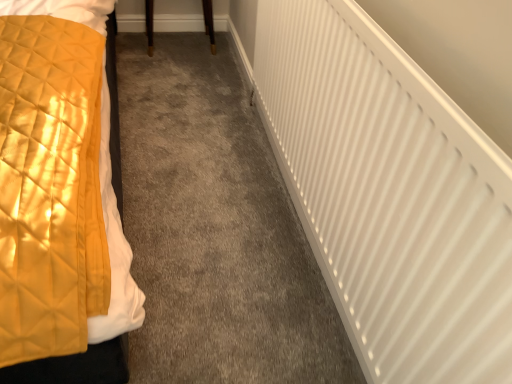
The height and width of the screenshot is (384, 512). Describe the element at coordinates (390, 194) in the screenshot. I see `white matte radiator at right` at that location.

At what (x,y) coordinates should I click in order to perform the action: click on white matte radiator at right. Please return your answer as a coordinate pair (x, y). The image size is (512, 384). Looking at the image, I should click on (390, 194).

Locate an element on the screen. brown wood table at upper center is located at coordinates (209, 23).

Describe the element at coordinates (209, 23) in the screenshot. I see `brown wood table at upper center` at that location.

Measure the distance between brown wood table at upper center and camera.

2.44 meters.

What is the approximate width of brown wood table at upper center?

brown wood table at upper center is 34.01 centimeters wide.

At what (x,y) coordinates should I click in order to perform the action: click on white matte radiator at right. Please return your answer as a coordinate pair (x, y). Looking at the image, I should click on (390, 194).

Considering the positions of objects brown wood table at upper center and white matte radiator at right in the image provided, who is more to the right, brown wood table at upper center or white matte radiator at right?

From the viewer's perspective, white matte radiator at right appears more on the right side.

In the scene shown: Relative to white matte radiator at right, is brown wood table at upper center in front or behind?

In the image, brown wood table at upper center appears behind white matte radiator at right.

Does point (206, 16) come in front of point (401, 288)?

No, (206, 16) is behind (401, 288).

From the image's perspective, between brown wood table at upper center and white matte radiator at right, who is located below?

white matte radiator at right is shown below in the image.

From a real-world perspective, is brown wood table at upper center physically located above or below white matte radiator at right?

In terms of real-world spatial position, brown wood table at upper center is below white matte radiator at right.

Does brown wood table at upper center have a lesser width compared to white matte radiator at right?

No.

Is brown wood table at upper center shorter than white matte radiator at right?

Correct, brown wood table at upper center is not as tall as white matte radiator at right.

Is brown wood table at upper center bigger or smaller than white matte radiator at right?

Clearly, brown wood table at upper center is smaller in size than white matte radiator at right.

Is brown wood table at upper center spatially inside white matte radiator at right, or outside of it?

brown wood table at upper center is spatially situated outside white matte radiator at right.

Is brown wood table at upper center far from white matte radiator at right?

Indeed, brown wood table at upper center is not near white matte radiator at right.

Is brown wood table at upper center turned away from white matte radiator at right?

No, brown wood table at upper center is not facing the opposite direction of white matte radiator at right.

At what (x,y) coordinates should I click in order to perform the action: click on radiator in front of the brown wood table at upper center. Please return your answer as a coordinate pair (x, y). This screenshot has height=384, width=512. Looking at the image, I should click on tap(390, 194).

Is white matte radiator at right to the right of brown wood table at upper center from the viewer's perspective?

Correct, you'll find white matte radiator at right to the right of brown wood table at upper center.

Considering the positions of objects white matte radiator at right and brown wood table at upper center in the image provided, who is in front, white matte radiator at right or brown wood table at upper center?

white matte radiator at right.

Which is less distant, (292, 128) or (212, 21)?

Point (292, 128).

From the image's perspective, between white matte radiator at right and brown wood table at upper center, which one is located above?

brown wood table at upper center appears higher in the image.

From a real-world perspective, between white matte radiator at right and brown wood table at upper center, who is vertically higher?

In real-world perspective, white matte radiator at right is above.

Does white matte radiator at right have a greater width compared to brown wood table at upper center?

Incorrect, the width of white matte radiator at right does not surpass that of brown wood table at upper center.

Is white matte radiator at right shorter than brown wood table at upper center?

No, white matte radiator at right is not shorter than brown wood table at upper center.

Between white matte radiator at right and brown wood table at upper center, which one has smaller size?

brown wood table at upper center is smaller.

Is brown wood table at upper center completely or partially inside white matte radiator at right?

No, brown wood table at upper center is not a part of white matte radiator at right.

Would you say white matte radiator at right is a long distance from brown wood table at upper center?

white matte radiator at right is far away from brown wood table at upper center.

Is white matte radiator at right looking in the opposite direction of brown wood table at upper center?

No, white matte radiator at right is not facing away from brown wood table at upper center.

This screenshot has width=512, height=384. Identify the location of furniture that appears below the white matte radiator at right (from a real-world perspective). (209, 23).

Find the location of a particular element. furniture behind the white matte radiator at right is located at coordinates (209, 23).

Locate an element on the screen. The height and width of the screenshot is (384, 512). radiator that appears above the brown wood table at upper center (from a real-world perspective) is located at coordinates (390, 194).